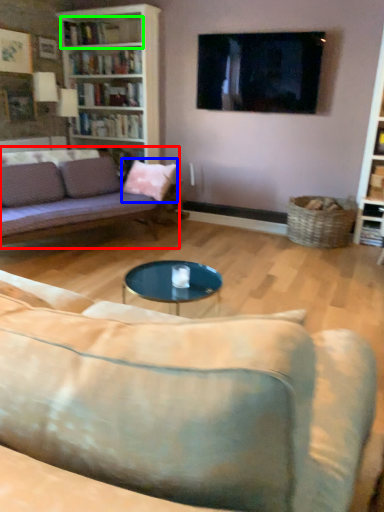
Question: Which object is positioned closest to studio couch (highlighted by a red box)? Select from throw pillow (highlighted by a blue box) and shelf (highlighted by a green box).

Choices:
 (A) throw pillow
 (B) shelf

Answer: (A)